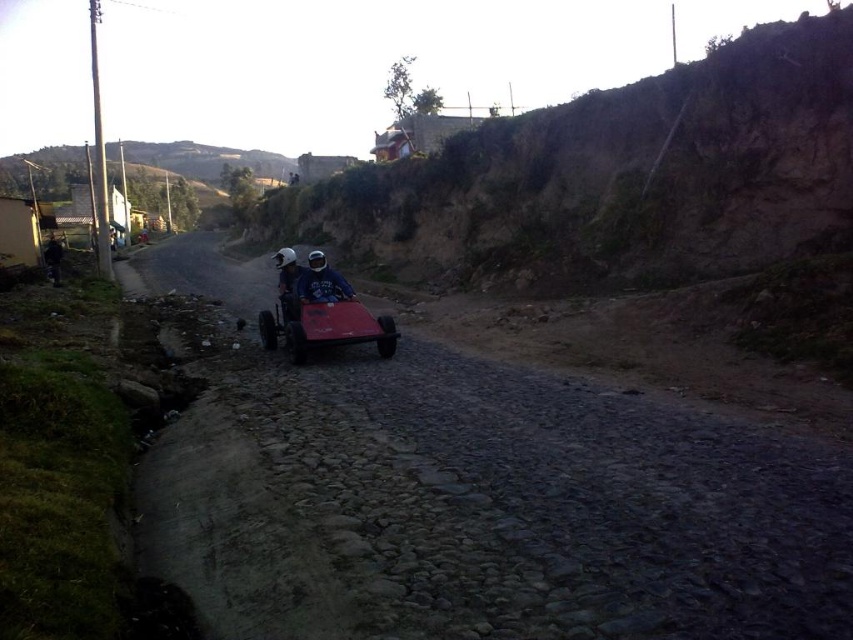
The height and width of the screenshot is (640, 853). What do you see at coordinates (323, 326) in the screenshot? I see `shiny red toy car at center` at bounding box center [323, 326].

Identify the location of shiny red toy car at center. (323, 326).

Does dirt track at center appear under matte white helmet at center?

Indeed, dirt track at center is positioned under matte white helmet at center.

Describe the element at coordinates (543, 500) in the screenshot. This screenshot has height=640, width=853. I see `dirt track at center` at that location.

You are a GUI agent. You are given a task and a screenshot of the screen. Output one action in this format:
    pyautogui.click(x=<x>, y=<y>)
    Task: Click on the dirt track at center
    
    Given the screenshot: What is the action you would take?
    pyautogui.click(x=543, y=500)

Does dirt track at center have a lesser height compared to shiny red toy car at center?

Indeed, dirt track at center has a lesser height compared to shiny red toy car at center.

Is point (200, 467) more distant than point (393, 349)?

No, it is in front of (393, 349).

Is point (422, 360) positioned after point (329, 314)?

Yes, point (422, 360) is farther from viewer.

What are the coordinates of `dirt track at center` in the screenshot? It's located at (543, 500).